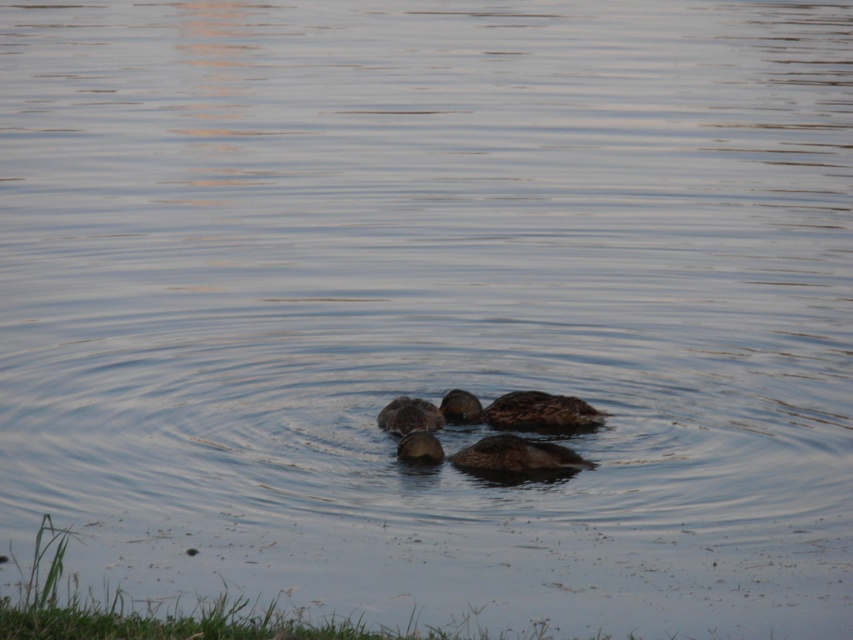
Between dark brown feathers at center and brown matte duck at center, which one has more height?

Standing taller between the two is dark brown feathers at center.

Is dark brown feathers at center smaller than brown matte duck at center?

No, dark brown feathers at center is not smaller than brown matte duck at center.

Locate an element on the screen. dark brown feathers at center is located at coordinates (521, 410).

Who is lower down, brown matte duck at center or brown matte duckling at center?

Positioned lower is brown matte duck at center.

Is point (561, 452) closer to camera compared to point (415, 458)?

Yes.

Is point (459, 461) less distant than point (432, 444)?

No, (459, 461) is further to viewer.

Where is `brown matte duck at center`? This screenshot has height=640, width=853. brown matte duck at center is located at coordinates (515, 456).

Which is below, brown matte duck at center or brown fuzzy duck at center?

brown matte duck at center is below.

Who is positioned more to the left, brown matte duck at center or brown fuzzy duck at center?

brown fuzzy duck at center is more to the left.

Which is behind, point (579, 458) or point (397, 416)?

The point (397, 416) is more distant.

Find the location of a particular element. brown matte duck at center is located at coordinates (515, 456).